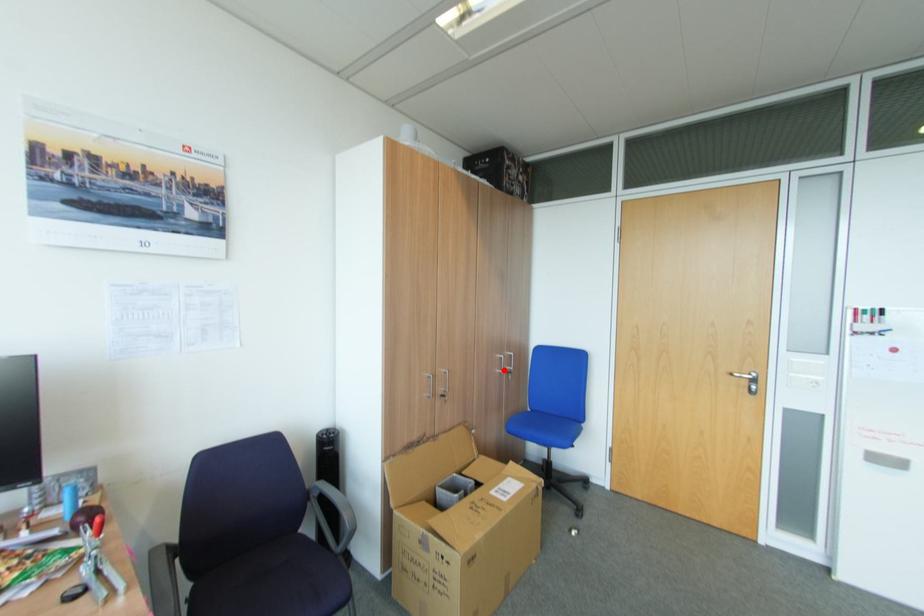
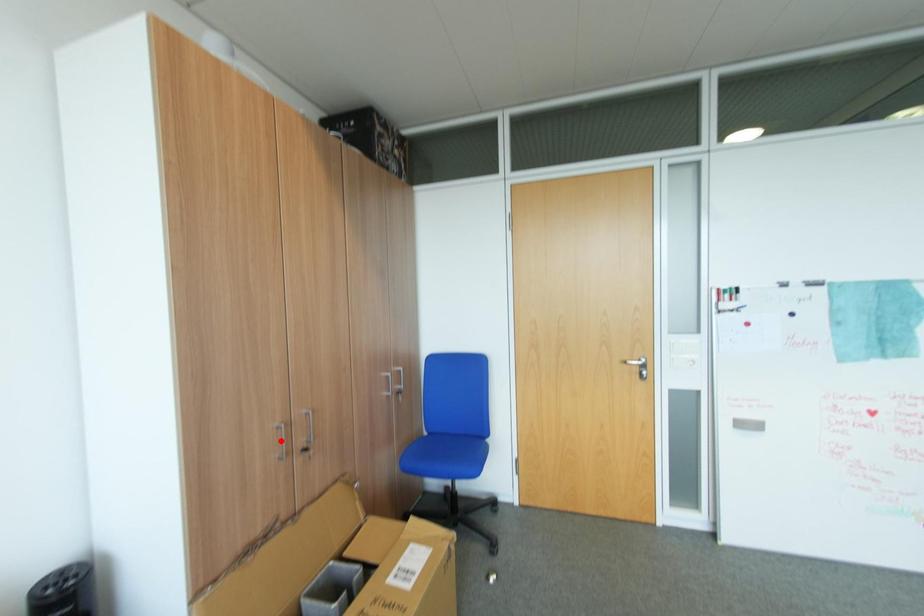
I am providing you with two images of the same scene from different viewpoints. A red point is marked on the first image and another point is marked on the second image. Are the points marked in image1 and image2 representing the same 3D position?

No